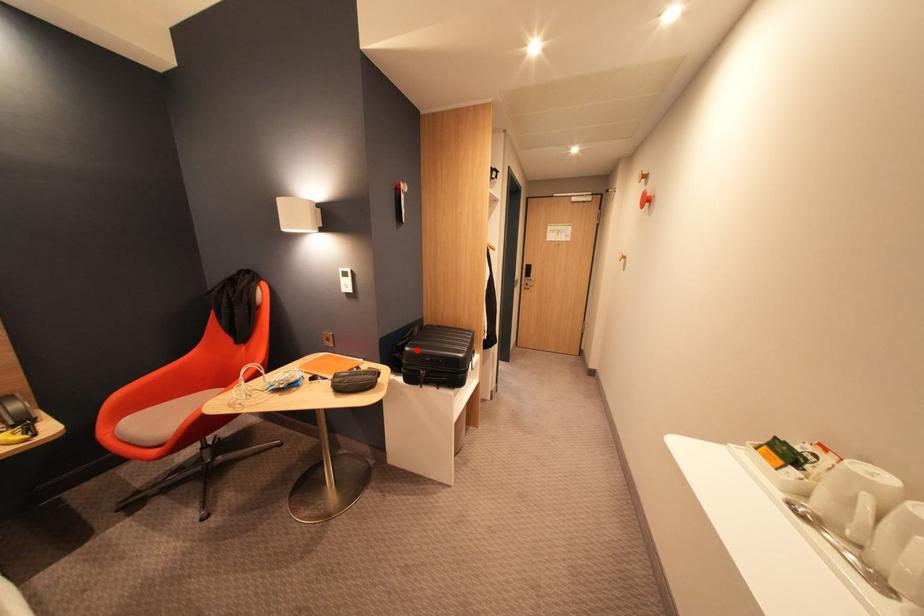
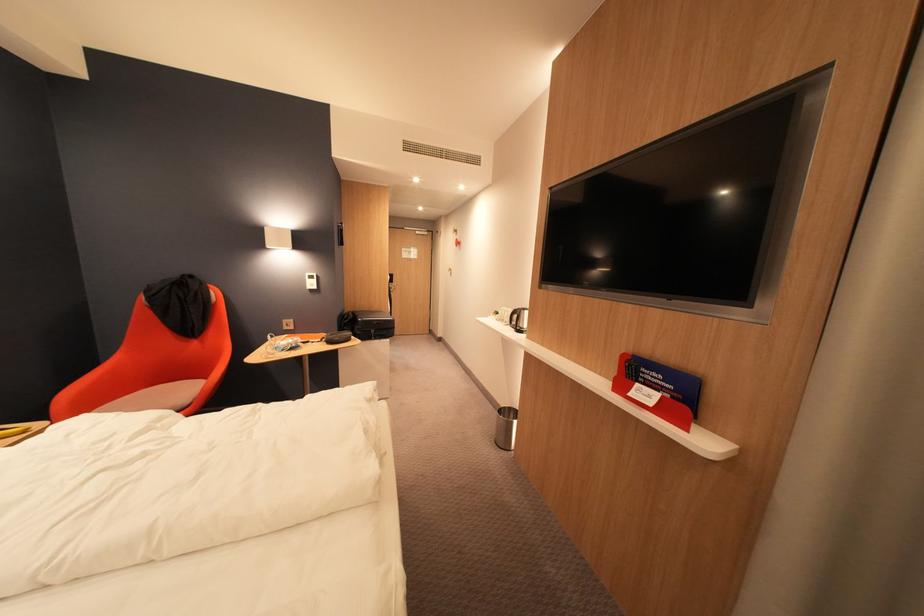
Question: I am providing you with two images of the same scene from different viewpoints. In image1, a red point is highlighted. Considering the same 3D point in image2, which of the following is correct?

Choices:
 (A) It is closer
 (B) It is farther

Answer: (A)